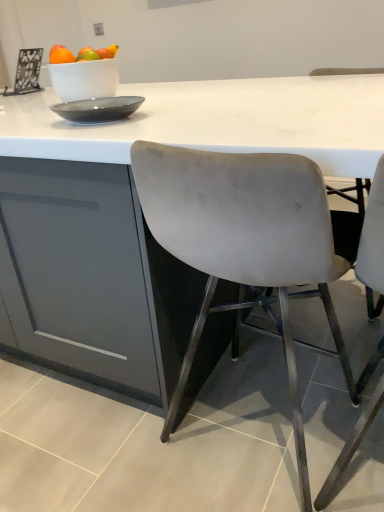
Question: Considering the relative positions of satin grey chair at center, placed as the second chair when sorted from right to left, and white marble table at center in the image provided, is satin grey chair at center, placed as the second chair when sorted from right to left, to the left of white marble table at center from the viewer's perspective?

Choices:
 (A) no
 (B) yes

Answer: (A)

Question: Is satin grey chair at center, placed as the second chair when sorted from right to left, smaller than white marble table at center?

Choices:
 (A) no
 (B) yes

Answer: (B)

Question: Is satin grey chair at center, placed as the second chair when sorted from right to left, completely or partially outside of white marble table at center?

Choices:
 (A) no
 (B) yes

Answer: (A)

Question: From the image's perspective, would you say satin grey chair at center, which is the 1th chair in left-to-right order, is positioned over white marble table at center?

Choices:
 (A) no
 (B) yes

Answer: (A)

Question: Does satin grey chair at center, which is the 1th chair in left-to-right order, come in front of white marble table at center?

Choices:
 (A) yes
 (B) no

Answer: (A)

Question: Looking at the image, does satin grey chair at center, placed as the second chair when sorted from right to left, seem bigger or smaller compared to matte gray chair at right, positioned as the second chair in left-to-right order?

Choices:
 (A) big
 (B) small

Answer: (A)

Question: Looking at their shapes, would you say satin grey chair at center, placed as the second chair when sorted from right to left, is wider or thinner than matte gray chair at right, positioned as the second chair in left-to-right order?

Choices:
 (A) wide
 (B) thin

Answer: (B)

Question: Considering the positions of point (297, 212) and point (365, 370), is point (297, 212) closer or farther from the camera than point (365, 370)?

Choices:
 (A) closer
 (B) farther

Answer: (A)

Question: Choose the correct answer: Is satin grey chair at center, which is the 1th chair in left-to-right order, inside matte gray chair at right, which appears as the first chair when viewed from the right, or outside it?

Choices:
 (A) inside
 (B) outside

Answer: (B)

Question: In terms of width, does white marble table at center look wider or thinner when compared to matte gray chair at right, positioned as the second chair in left-to-right order?

Choices:
 (A) wide
 (B) thin

Answer: (A)

Question: Does point (382, 75) appear closer or farther from the camera than point (372, 215)?

Choices:
 (A) farther
 (B) closer

Answer: (A)

Question: From a real-world perspective, is white marble table at center physically located above or below matte gray chair at right, which appears as the first chair when viewed from the right?

Choices:
 (A) below
 (B) above

Answer: (A)

Question: In the image, is white marble table at center on the left side or the right side of matte gray chair at right, positioned as the second chair in left-to-right order?

Choices:
 (A) left
 (B) right

Answer: (A)

Question: From a real-world perspective, is matte gray chair at right, which appears as the first chair when viewed from the right, above or below white marble table at center?

Choices:
 (A) above
 (B) below

Answer: (A)

Question: Is matte gray chair at right, positioned as the second chair in left-to-right order, in front of or behind white marble table at center in the image?

Choices:
 (A) behind
 (B) front

Answer: (B)